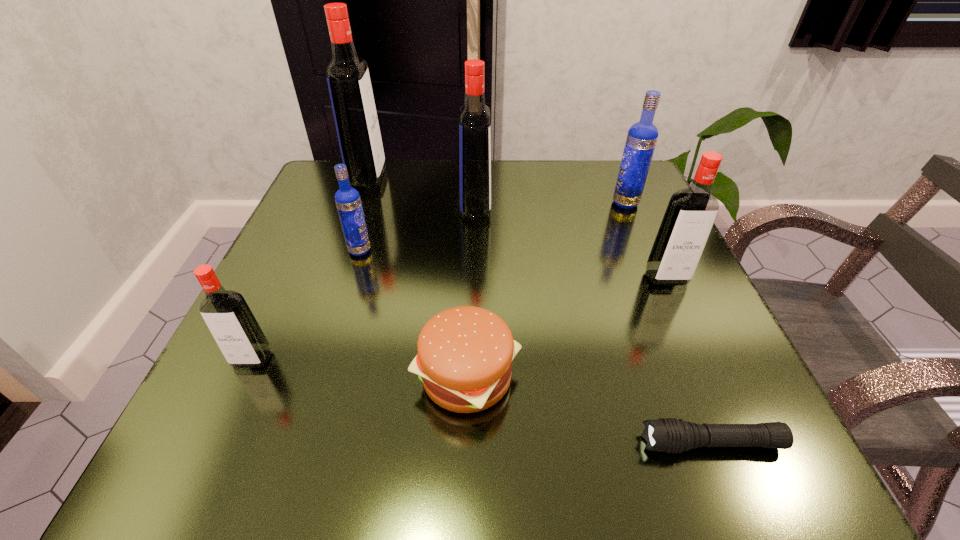
Image resolution: width=960 pixels, height=540 pixels. In order to click on vacant space located on the front and back of the nearest vodka in this screenshot , I will do `click(228, 413)`.

This screenshot has width=960, height=540. I want to click on vacant space located 0.050m on the front of the seventh tallest object, so click(465, 464).

Locate an element on the screen. vacant region located at the lens end of the shortest object is located at coordinates (394, 443).

This screenshot has height=540, width=960. I want to click on vacant space located at the lens end of the shortest object, so click(565, 443).

Image resolution: width=960 pixels, height=540 pixels. In order to click on vacant space located 0.390m at the lens end of the shortest object in this screenshot , I will do `click(339, 443)`.

Locate an element on the screen. The width and height of the screenshot is (960, 540). hamburger that is at the near edge is located at coordinates (465, 354).

Where is `flashlight positioned at the near edge`? flashlight positioned at the near edge is located at coordinates (671, 435).

This screenshot has width=960, height=540. What are the coordinates of `flashlight that is at the right edge` in the screenshot? It's located at coord(671,435).

Find the location of a particular element. object that is positioned at the far left corner is located at coordinates (349, 84).

Where is `object at the far right corner`? Image resolution: width=960 pixels, height=540 pixels. object at the far right corner is located at coordinates (642, 136).